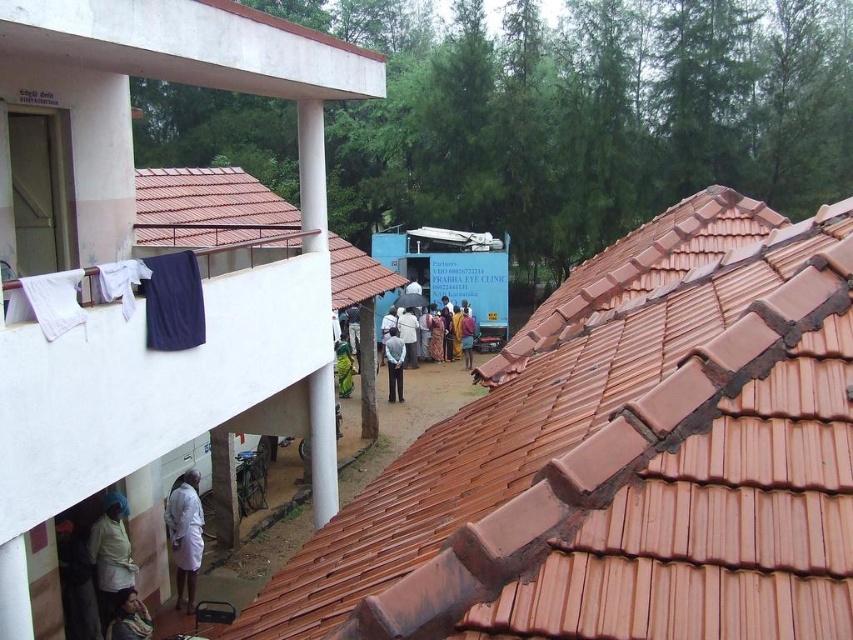
You are a delivery person who needs to place a package on the white smooth roof at upper left. The package is 2 feet in height. You are standing next to the white cotton dress at lower left. Can you safely place the package on the roof without climbing?

The distance between the white smooth roof at upper left and the white cotton dress at lower left is 21.69 feet. Since the package is only 2 feet tall, you cannot reach the roof from the ground level where the white cotton dress is located. You would need a ladder or another elevated platform to safely place the package on the roof.

Consider the image. You are a photographer trying to capture the entire terracotta tile roof at upper left and the light brown fabric at lower left in one frame. Given that your camera can only fit objects with a combined width of 10 meters, will you be able to do so?

The terracotta tile roof at upper left has a larger width than the light brown fabric at lower left. However, without knowing the exact widths of each object, it is impossible to determine if their combined width exceeds 10 meters. Additional measurements are needed.

You are standing in front of the building with terracotta tiles and looking at the scene. There are two points marked in the image, point (291, 225) and point (149, 616). Which point is closer to you?

Point (291, 225) is further to the camera than point (149, 616), so the point closer to you is point (149, 616).